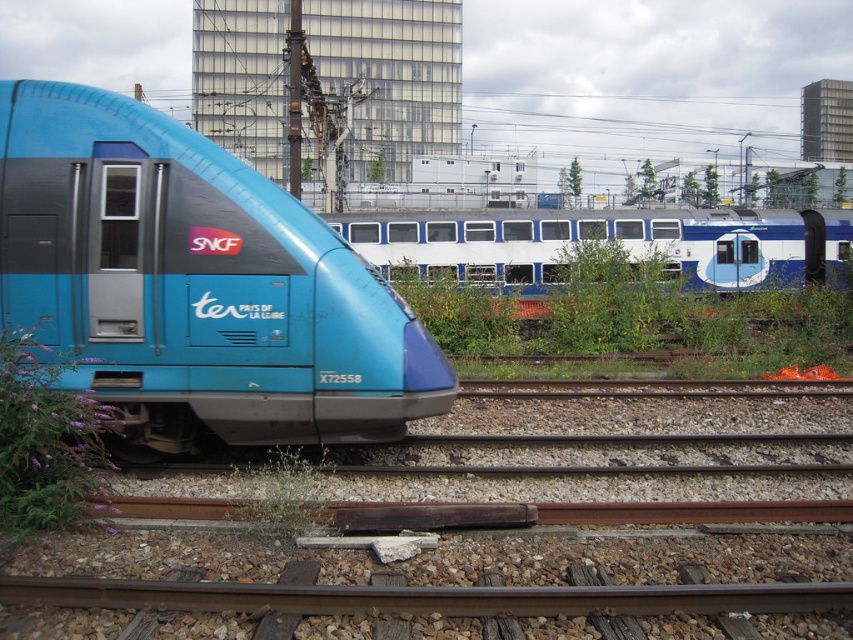
Is matte blue train at left shorter than white glossy passenger train at center?

Correct, matte blue train at left is not as tall as white glossy passenger train at center.

Does matte blue train at left have a lesser width compared to white glossy passenger train at center?

Correct, matte blue train at left's width is less than white glossy passenger train at center's.

Between point (329, 337) and point (666, 260), which one is positioned behind?

The point (666, 260) is more distant.

Where is `matte blue train at left`? The height and width of the screenshot is (640, 853). matte blue train at left is located at coordinates (195, 284).

Who is positioned more to the left, white glossy passenger train at center or purple soft plant at lower left?

Positioned to the left is purple soft plant at lower left.

I want to click on white glossy passenger train at center, so click(x=605, y=240).

What do you see at coordinates (195, 284) in the screenshot? I see `matte blue train at left` at bounding box center [195, 284].

Is point (219, 403) farther from camera compared to point (85, 477)?

Yes, point (219, 403) is farther from viewer.

Is point (285, 275) positioned behind point (62, 432)?

Yes, it is behind point (62, 432).

Identify the location of matte blue train at left. (195, 284).